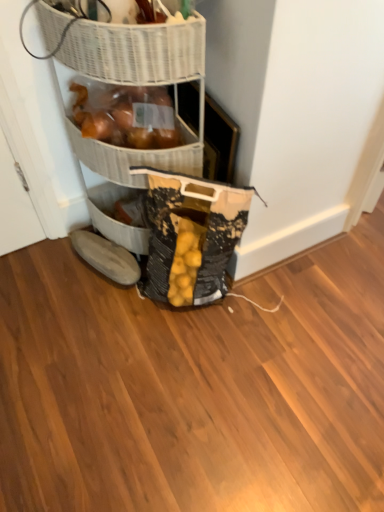
Where is `vacant position to the left of textured canvas bag at lower center`? vacant position to the left of textured canvas bag at lower center is located at coordinates (107, 318).